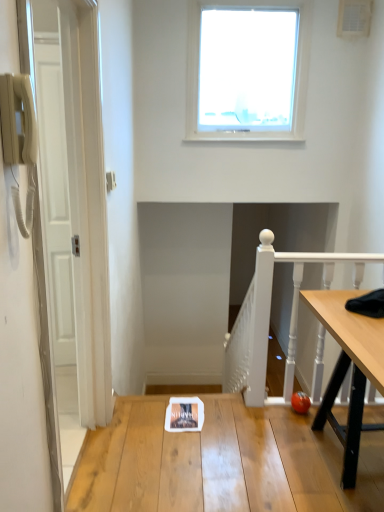
Question: Looking at the image, does wooden table at center seem bigger or smaller compared to white painted wood at right?

Choices:
 (A) small
 (B) big

Answer: (B)

Question: In the image, is wooden table at center on the left side or the right side of white painted wood at right?

Choices:
 (A) right
 (B) left

Answer: (B)

Question: Based on their relative distances, which object is farther from the wooden table at center?

Choices:
 (A) white painted wood at right
 (B) transparent glass window at upper center

Answer: (B)

Question: Based on their relative distances, which object is nearer to the white painted wood at right?

Choices:
 (A) transparent glass window at upper center
 (B) wooden table at center

Answer: (B)